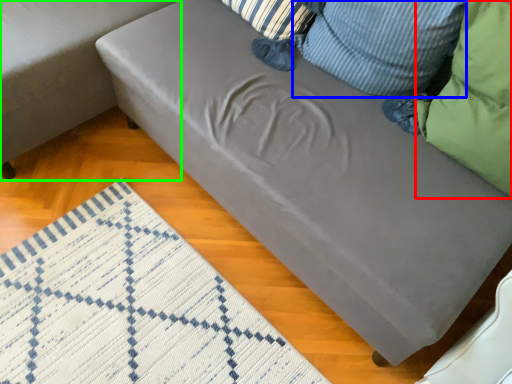
Question: Based on their relative distances, which object is nearer to pillow (highlighted by a red box)? Choose from pillow (highlighted by a blue box) and studio couch (highlighted by a green box).

Choices:
 (A) pillow
 (B) studio couch

Answer: (A)